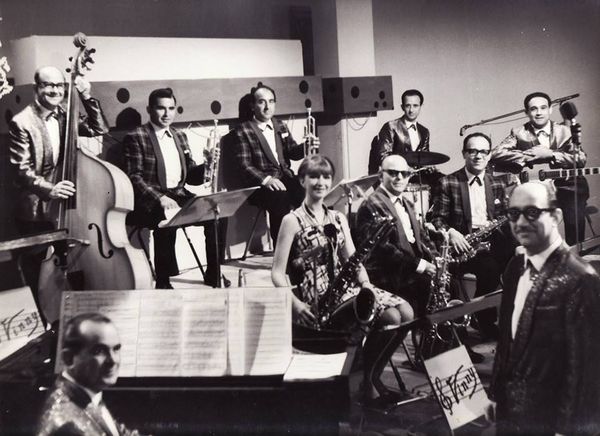
This screenshot has width=600, height=436. I want to click on wall, so click(463, 30).